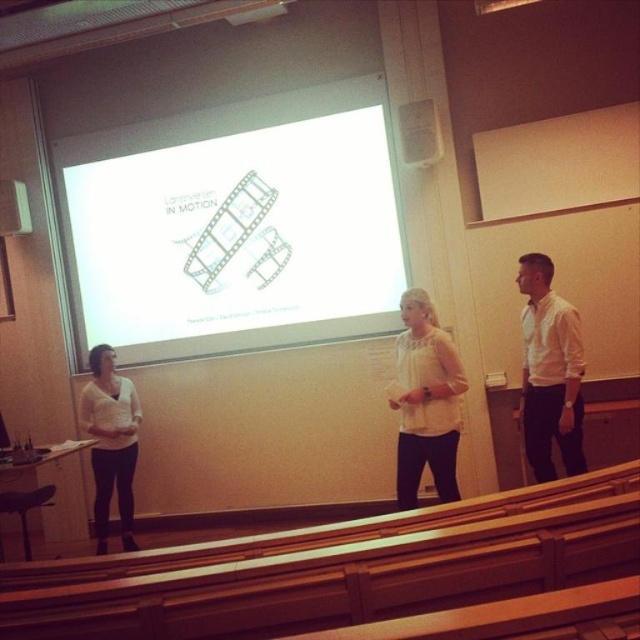
Is the position of white matte projection screen at center less distant than that of white matte shirt at center?

No, white matte projection screen at center is further to the viewer.

Is white matte projection screen at center bigger than white matte shirt at center?

Yes, white matte projection screen at center is bigger than white matte shirt at center.

Who is more distant from viewer, [196,248] or [104,493]?

Positioned behind is point [196,248].

This screenshot has height=640, width=640. I want to click on white matte projection screen at center, so click(236, 225).

Which is more to the left, white shirt at right or white matte blouse at center?

white matte blouse at center is more to the left.

Which is behind, point (541, 419) or point (440, 442)?

Point (541, 419)

At what (x,y) coordinates should I click in order to perform the action: click on white shirt at right. Please return your answer as a coordinate pair (x, y). The width and height of the screenshot is (640, 640). Looking at the image, I should click on (548, 371).

Does white matte projection screen at center appear on the right side of white shirt at right?

In fact, white matte projection screen at center is to the left of white shirt at right.

Does white matte projection screen at center appear under white shirt at right?

Incorrect, white matte projection screen at center is not positioned below white shirt at right.

This screenshot has height=640, width=640. Describe the element at coordinates (236, 225) in the screenshot. I see `white matte projection screen at center` at that location.

Identify the location of white matte projection screen at center. This screenshot has width=640, height=640. (236, 225).